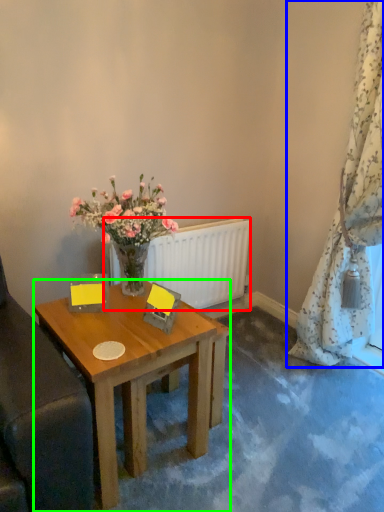
Question: Estimate the real-world distances between objects in this image. Which object is closer to radiator (highlighted by a red box), curtain (highlighted by a blue box) or desk (highlighted by a green box)?

Choices:
 (A) curtain
 (B) desk

Answer: (B)